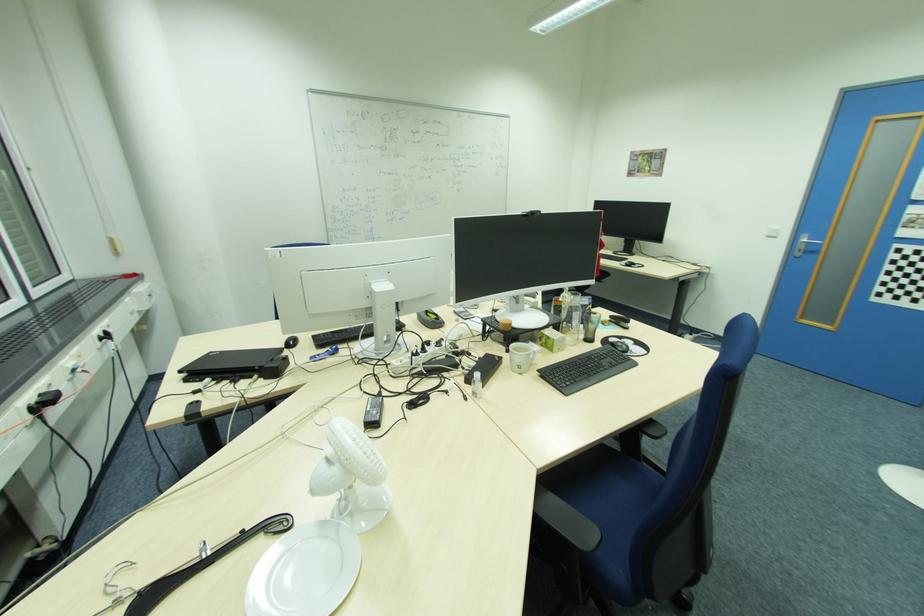
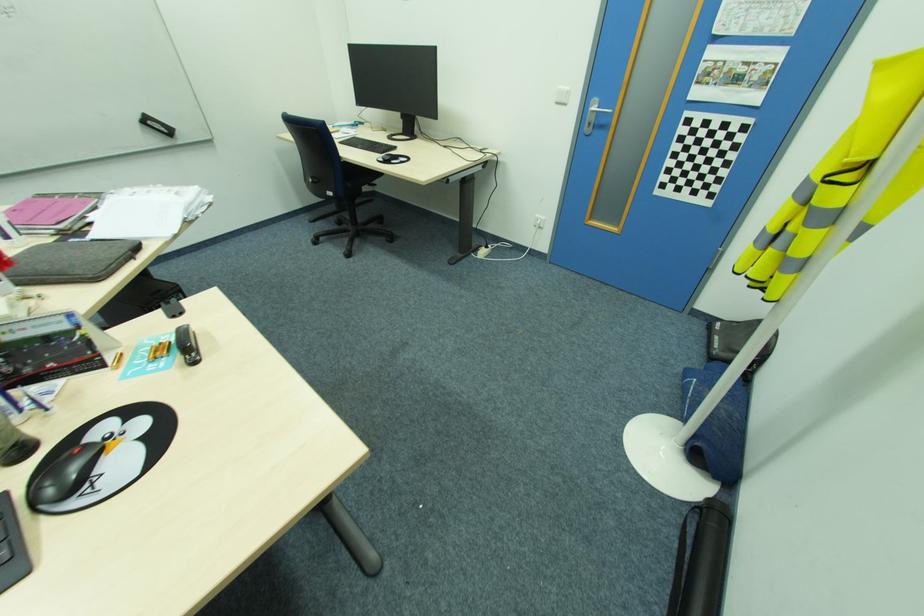
The images are taken continuously from a first-person perspective. In which direction are you moving?

The movement direction of the cameraman is right, forward.